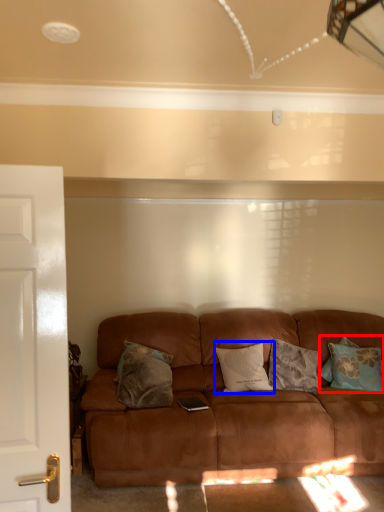
Question: Among these objects, which one is nearest to the camera, pillow (highlighted by a red box) or pillow (highlighted by a blue box)?

Choices:
 (A) pillow
 (B) pillow

Answer: (B)